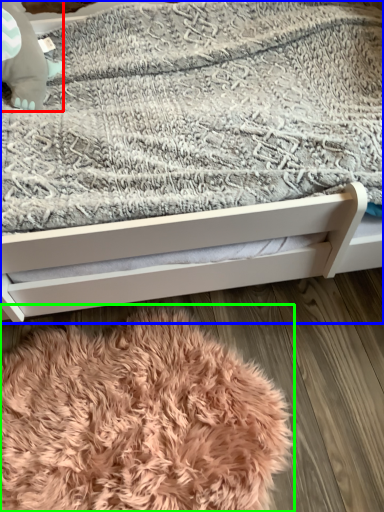
Question: Which is farther away from baby elephant (highlighted by a red box)? bed (highlighted by a blue box) or blanket (highlighted by a green box)?

Choices:
 (A) bed
 (B) blanket

Answer: (B)